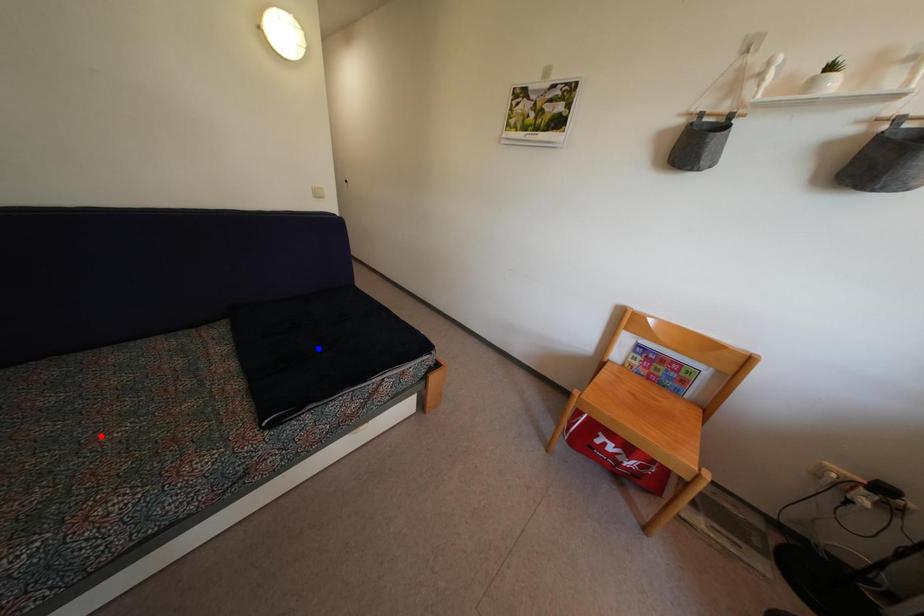
Question: Two points are marked on the image. Which point is closer to the camera?

Choices:
 (A) Blue point is closer.
 (B) Red point is closer.

Answer: (B)